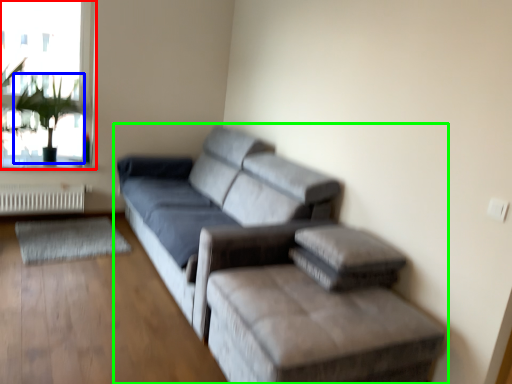
Question: Which object is positioned farthest from window (highlighted by a red box)? Select from plant (highlighted by a blue box) and studio couch (highlighted by a green box).

Choices:
 (A) plant
 (B) studio couch

Answer: (B)